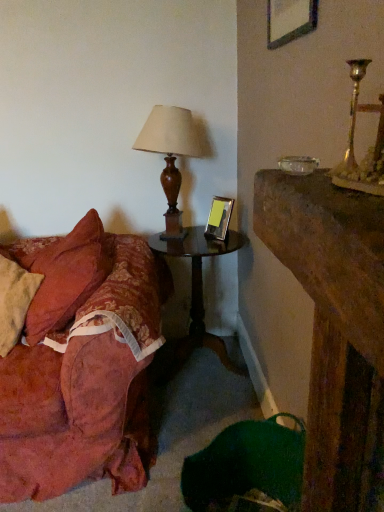
Describe the element at coordinates (170, 156) in the screenshot. I see `wooden lampshade at left` at that location.

The image size is (384, 512). Describe the element at coordinates (289, 20) in the screenshot. I see `wooden picture frame at upper center, arranged as the first picture frame when viewed from the front` at that location.

This screenshot has height=512, width=384. What do you see at coordinates (353, 143) in the screenshot?
I see `gold metallic candle holder at upper right` at bounding box center [353, 143].

This screenshot has width=384, height=512. Find the location of `floral fabric couch at left`. floral fabric couch at left is located at coordinates (77, 360).

Is wooden lampshade at left with wooden dark brown side table at center?

No, wooden lampshade at left is not in contact with wooden dark brown side table at center.

Would you say wooden lampshade at left is to the left or to the right of wooden dark brown side table at center in the picture?

wooden lampshade at left is positioned on wooden dark brown side table at center's left side.

What's the angular difference between wooden lampshade at left and wooden dark brown side table at center's facing directions?

There is a 0.000159-degree angle between the facing directions of wooden lampshade at left and wooden dark brown side table at center.

At what (x,y) coordinates should I click in order to perform the action: click on lamp that appears in front of the wooden dark brown side table at center. Please return your answer as a coordinate pair (x, y). Looking at the image, I should click on (170, 156).

Considering the relative positions of wooden dark brown side table at center and floral fabric couch at left in the image provided, is wooden dark brown side table at center to the left or to the right of floral fabric couch at left?

In the image, wooden dark brown side table at center appears on the right side of floral fabric couch at left.

How many degrees apart are the facing directions of wooden dark brown side table at center and floral fabric couch at left?

The angle between the facing direction of wooden dark brown side table at center and the facing direction of floral fabric couch at left is 0.000103 degrees.

From the image's perspective, which is above, wooden dark brown side table at center or floral fabric couch at left?

wooden dark brown side table at center.

Between point (216, 337) and point (81, 220), which one is positioned behind?

The point (216, 337) is farther from the camera.

Could you measure the distance between wooden picture frame at upper center, the first picture frame from the top, and floral fabric couch at left?

wooden picture frame at upper center, the first picture frame from the top, is 4.28 feet from floral fabric couch at left.

Does wooden picture frame at upper center, placed as the 2th picture frame when sorted from back to front, have a greater width compared to floral fabric couch at left?

No, wooden picture frame at upper center, placed as the 2th picture frame when sorted from back to front, is not wider than floral fabric couch at left.

From a real-world perspective, is wooden picture frame at upper center, which is the 1th picture frame in right-to-left order, positioned over floral fabric couch at left based on gravity?

Yes, from a real-world perspective, wooden picture frame at upper center, which is the 1th picture frame in right-to-left order, is on top of floral fabric couch at left.

Can you confirm if wooden picture frame at upper center, arranged as the first picture frame when viewed from the front, is shorter than floral fabric couch at left?

Indeed, wooden picture frame at upper center, arranged as the first picture frame when viewed from the front, has a lesser height compared to floral fabric couch at left.

From the image's perspective, does metallic silver picture frame at center, which ranks as the first picture frame in bottom-to-top order, appear lower than floral fabric couch at left?

Incorrect, from the image's perspective, metallic silver picture frame at center, which ranks as the first picture frame in bottom-to-top order, is higher than floral fabric couch at left.

Between metallic silver picture frame at center, which ranks as the first picture frame in bottom-to-top order, and floral fabric couch at left, which one has smaller size?

With smaller size is metallic silver picture frame at center, which ranks as the first picture frame in bottom-to-top order.

Where is `picture frame that is behind the floral fabric couch at left`? This screenshot has height=512, width=384. picture frame that is behind the floral fabric couch at left is located at coordinates (219, 219).

Is metallic silver picture frame at center, which ranks as the first picture frame in bottom-to-top order, inside or outside of floral fabric couch at left?

metallic silver picture frame at center, which ranks as the first picture frame in bottom-to-top order, is located beyond the bounds of floral fabric couch at left.

Consider the image. From the image's perspective, is wooden picture frame at upper center, which is the 1th picture frame in right-to-left order, under wooden dark brown side table at center?

No.

Is wooden picture frame at upper center, which is the 2th picture frame in bottom-to-top order, far away from wooden dark brown side table at center?

Yes, wooden picture frame at upper center, which is the 2th picture frame in bottom-to-top order, and wooden dark brown side table at center are located far from each other.

Is wooden picture frame at upper center, arranged as the first picture frame when viewed from the front, to the left or to the right of wooden dark brown side table at center in the image?

wooden picture frame at upper center, arranged as the first picture frame when viewed from the front, is positioned on wooden dark brown side table at center's right side.

Is wooden picture frame at upper center, arranged as the first picture frame when viewed from the front, looking in the opposite direction of wooden dark brown side table at center?

wooden picture frame at upper center, arranged as the first picture frame when viewed from the front, is not turned away from wooden dark brown side table at center.

In the scene shown: Can you confirm if floral fabric couch at left is smaller than wooden picture frame at upper center, the first picture frame from the top?

Actually, floral fabric couch at left might be larger than wooden picture frame at upper center, the first picture frame from the top.

Does floral fabric couch at left come in front of wooden picture frame at upper center, the first picture frame from the top?

No.

Considering the sizes of objects floral fabric couch at left and wooden picture frame at upper center, the first picture frame from the top, in the image provided, who is taller, floral fabric couch at left or wooden picture frame at upper center, the first picture frame from the top,?

floral fabric couch at left is taller.

Which is farther, (79, 348) or (309, 15)?

Point (79, 348)

Which is more distant, (281, 23) or (380, 196)?

Point (281, 23)

Can you tell me how much wooden picture frame at upper center, placed as the 2th picture frame when sorted from back to front, and gold metallic candle holder at upper right differ in facing direction?

0.00927 degrees.

Considering the relative positions of wooden picture frame at upper center, which is counted as the second picture frame, starting from the left, and gold metallic candle holder at upper right in the image provided, is wooden picture frame at upper center, which is counted as the second picture frame, starting from the left, in front of gold metallic candle holder at upper right?

No, wooden picture frame at upper center, which is counted as the second picture frame, starting from the left, is behind gold metallic candle holder at upper right.

Can you confirm if wooden picture frame at upper center, which is the 2th picture frame in bottom-to-top order, is smaller than gold metallic candle holder at upper right?

Incorrect, wooden picture frame at upper center, which is the 2th picture frame in bottom-to-top order, is not smaller in size than gold metallic candle holder at upper right.

In order to click on nightstand located on the right of wooden lampshade at left in this screenshot , I will do `click(197, 292)`.

This screenshot has width=384, height=512. What are the coordinates of `studio couch that is in front of the wooden dark brown side table at center` in the screenshot? It's located at (77, 360).

When comparing their distances from wooden dark brown side table at center, does metallic silver picture frame at center, which is the 2th picture frame from top to bottom, or gold metallic candle holder at upper right seem closer?

metallic silver picture frame at center, which is the 2th picture frame from top to bottom.

From the image, which object appears to be nearer to wooden dark brown side table at center, wooden lampshade at left or gold metallic candle holder at upper right?

wooden lampshade at left is closer to wooden dark brown side table at center.

When comparing their distances from gold metallic candle holder at upper right, does wooden lampshade at left or wooden dark brown side table at center seem further?

The object further to gold metallic candle holder at upper right is wooden dark brown side table at center.

Considering their positions, is wooden dark brown side table at center positioned closer to gold metallic candle holder at upper right than wooden lampshade at left?

wooden lampshade at left is closer to gold metallic candle holder at upper right.

From the image, which object appears to be nearer to gold metallic candle holder at upper right, wooden picture frame at upper center, which is the 2th picture frame in bottom-to-top order, or wooden dark brown side table at center?

wooden picture frame at upper center, which is the 2th picture frame in bottom-to-top order, is positioned closer to the anchor gold metallic candle holder at upper right.

When comparing their distances from wooden dark brown side table at center, does wooden lampshade at left or floral fabric couch at left seem further?

The object further to wooden dark brown side table at center is floral fabric couch at left.

Estimate the real-world distances between objects in this image. Which object is further from wooden dark brown side table at center, gold metallic candle holder at upper right or floral fabric couch at left?

gold metallic candle holder at upper right lies further to wooden dark brown side table at center than the other object.

Based on their spatial positions, is wooden dark brown side table at center or gold metallic candle holder at upper right closer to floral fabric couch at left?

Based on the image, wooden dark brown side table at center appears to be nearer to floral fabric couch at left.

You are a GUI agent. You are given a task and a screenshot of the screen. Output one action in this format:
    pyautogui.click(x=<x>, y=<y>)
    Task: Click on the picture frame between gold metallic candle holder at upper right and wooden lampshade at left in the front-back direction
    The height and width of the screenshot is (512, 384).
    Given the screenshot: What is the action you would take?
    pyautogui.click(x=289, y=20)

Locate an element on the screen. This screenshot has width=384, height=512. studio couch between gold metallic candle holder at upper right and wooden dark brown side table at center from front to back is located at coordinates (77, 360).

This screenshot has height=512, width=384. Identify the location of studio couch located between gold metallic candle holder at upper right and wooden lampshade at left in the depth direction. (77, 360).

Where is `nightstand between wooden lampshade at left and floral fabric couch at left in the up-down direction`? The height and width of the screenshot is (512, 384). nightstand between wooden lampshade at left and floral fabric couch at left in the up-down direction is located at coordinates (197, 292).